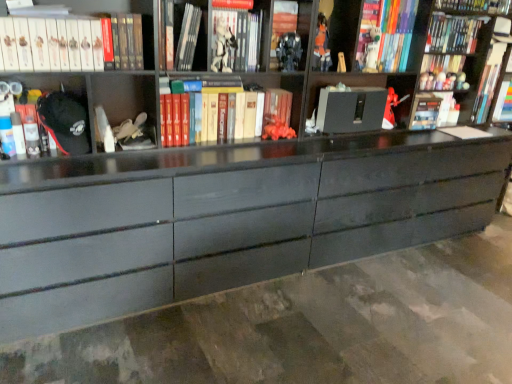
Question: Based on their sizes in the image, would you say metallic silver robot at center, which is the 2th toy in front-to-back order, is bigger or smaller than white matte book at upper left, marked as the tenth book in a right-to-left arrangement?

Choices:
 (A) big
 (B) small

Answer: (B)

Question: Visually, is metallic silver robot at center, which ranks as the third toy in right-to-left order, positioned to the left or to the right of white matte book at upper left, marked as the tenth book in a right-to-left arrangement?

Choices:
 (A) right
 (B) left

Answer: (A)

Question: Estimate the real-world distances between objects in this image. Which object is farther from the matte red figurine at upper right, which is counted as the 1th toy, starting from the back?

Choices:
 (A) hardcover book at upper right, which ranks as the second book in right-to-left order
 (B) matte black figurine at upper center, the fifth toy from the back
 (C) hardcover book at upper right, which is counted as the eighth book, starting from the left
 (D) hardcover book at upper left, arranged as the second book when viewed from the left
 (E) black matte cabinet at center

Answer: (D)

Question: Based on their relative distances, which object is farther from the orange matte toy at center, the fourth toy from the right?

Choices:
 (A) hardcover book at upper center, which ranks as the 6th book in left-to-right order
 (B) hardcover book at upper left, marked as the 3th book in a left-to-right arrangement
 (C) matte black figurine at upper center, the fifth toy from the back
 (D) matte red figurine at upper right, the 5th toy from the front
 (E) hardcover book at upper right, which is counted as the eighth book, starting from the left

Answer: (E)